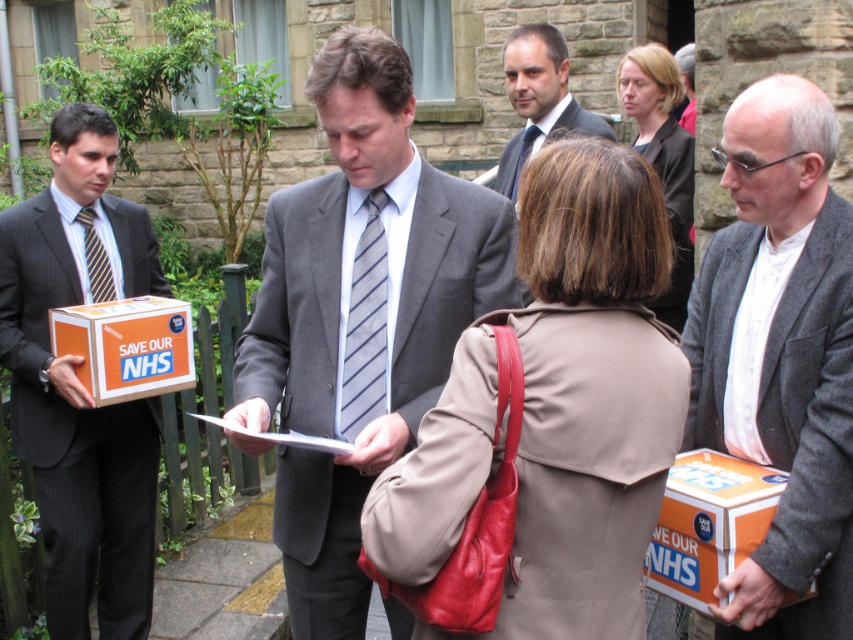
Is the position of matte black coat at center more distant than that of striped silk tie at left?

Yes.

Locate an element on the screen. Image resolution: width=853 pixels, height=640 pixels. matte black coat at center is located at coordinates coord(663,160).

Find the location of a particular element. matte black coat at center is located at coordinates (663, 160).

Looking at this image, can you confirm if matte black suit at left is smaller than striped fabric tie at center?

Actually, matte black suit at left might be larger than striped fabric tie at center.

Between matte black suit at left and striped fabric tie at center, which one is positioned lower?

matte black suit at left is lower down.

Locate an element on the screen. The image size is (853, 640). matte black suit at left is located at coordinates (80, 387).

Locate an element on the screen. matte black suit at left is located at coordinates (80, 387).

Between gray suit at center and gray wool coat at right, which one appears on the right side from the viewer's perspective?

From the viewer's perspective, gray wool coat at right appears more on the right side.

Who is shorter, gray suit at center or gray wool coat at right?

Standing shorter between the two is gray wool coat at right.

Is point (274, 228) behind point (711, 416)?

Yes, it is.

The width and height of the screenshot is (853, 640). I want to click on gray suit at center, so click(x=360, y=316).